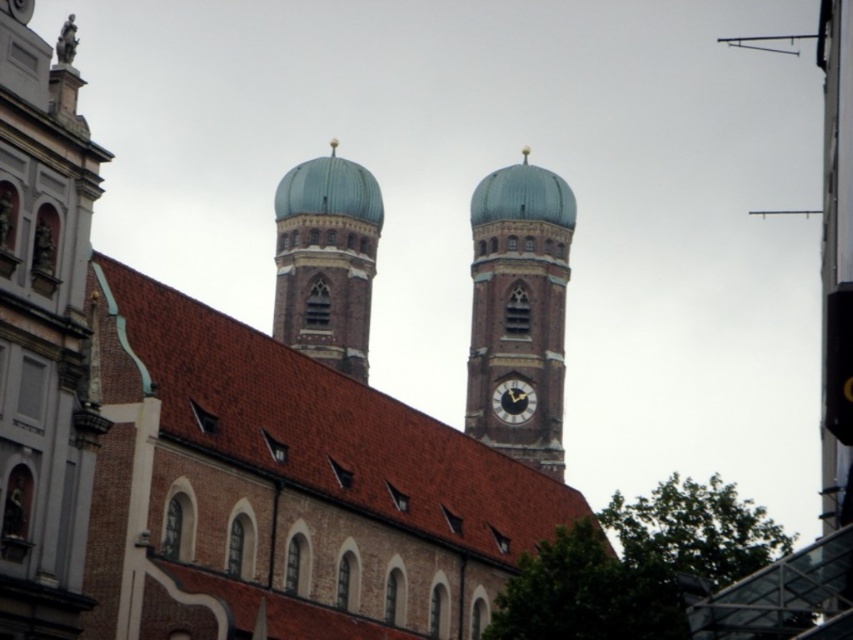
Looking at this image, you are standing at the base of the historic building and want to take a photo of the point at coordinate point (471,208). Given that your camera has a maximum focus range of 150 meters, will you be able to focus on that point?

The distance of point (471,208) from the camera is 135.43 meters, which is within the camera maximum focus range of 150 meters. Therefore, the camera can focus on the point.